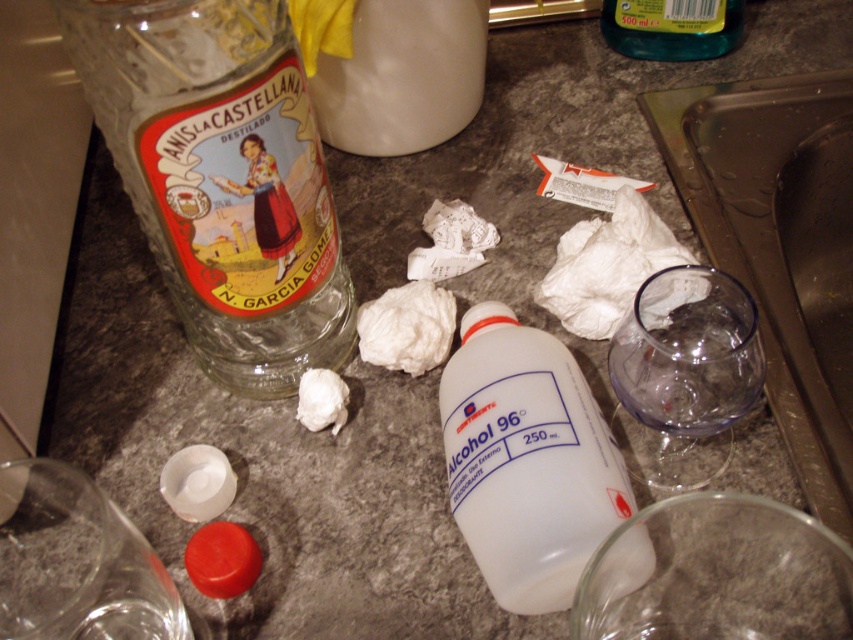
Is point (264, 317) in front of point (370, 324)?

Yes, it is in front of point (370, 324).

Is transparent glass bottle at upper left positioned behind white fabric at center?

No.

Image resolution: width=853 pixels, height=640 pixels. What are the coordinates of `transparent glass bottle at upper left` in the screenshot? It's located at (221, 177).

Is white crumpled paper at center shorter than white fabric at center?

No, white crumpled paper at center is not shorter than white fabric at center.

Is white crumpled paper at center to the left of white fabric at center from the viewer's perspective?

In fact, white crumpled paper at center is to the right of white fabric at center.

Is point (595, 284) in front of point (405, 362)?

That is False.

This screenshot has height=640, width=853. I want to click on white crumpled paper at center, so click(x=607, y=266).

Describe the element at coordinates (526, 460) in the screenshot. The height and width of the screenshot is (640, 853). I see `white plastic bottle at center` at that location.

Does white plastic bottle at center appear on the right side of green translucent bottle at upper right?

No, white plastic bottle at center is not to the right of green translucent bottle at upper right.

Identify the location of white plastic bottle at center. (526, 460).